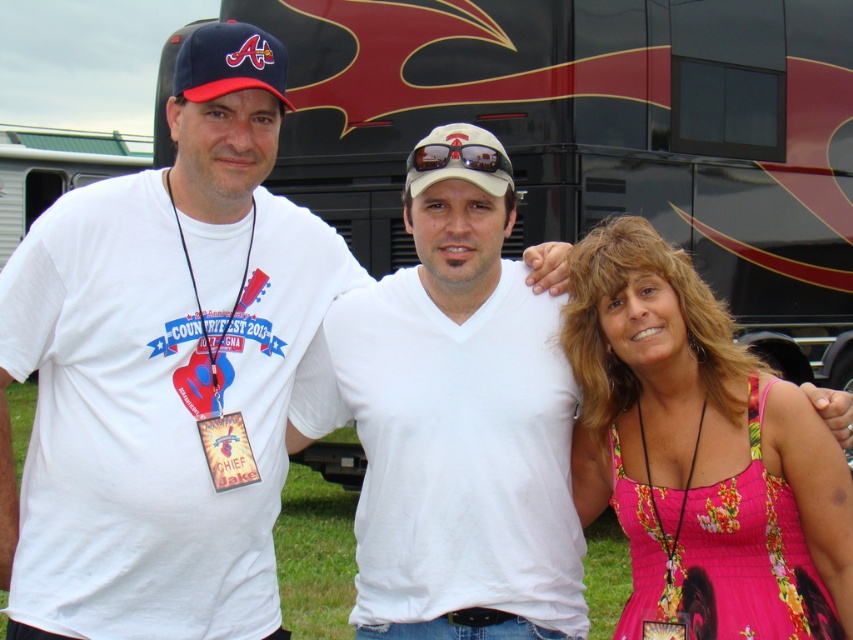
You are a photographer setting up for a group photo. You need to ensure that the pink floral dress at center and the white matte baseball cap at center are both visible in the frame. Given their sizes, which object might require you to adjust your camera angle to ensure it fits within the shot?

The pink floral dress at center has a larger width than the white matte baseball cap at center, so it might require adjusting the camera angle to ensure it fits within the shot.